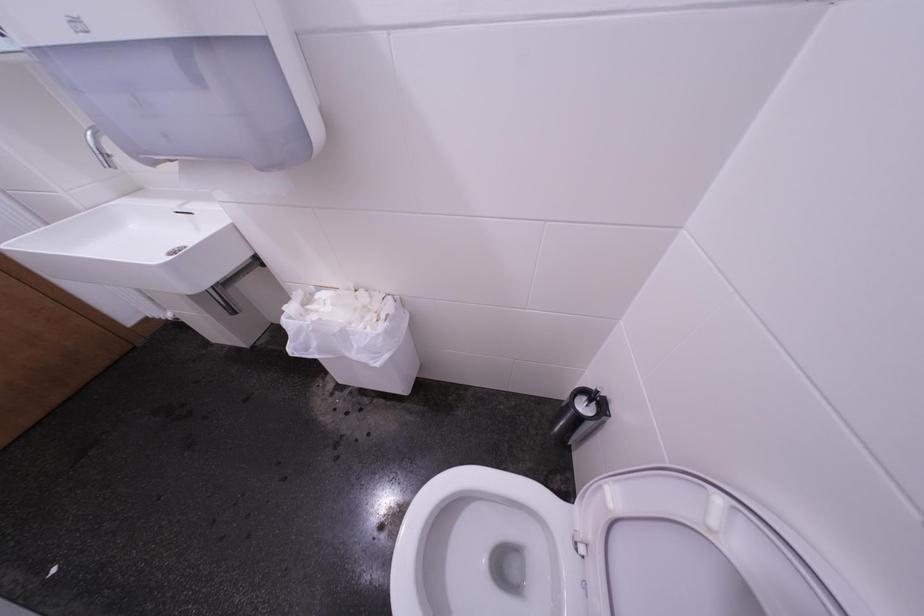
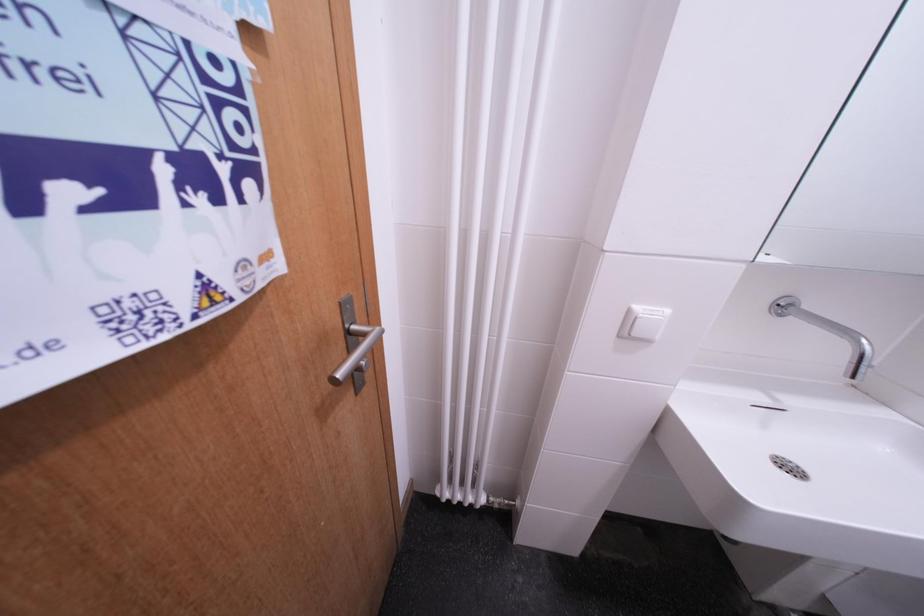
Question: Which direction would the cameraman need to move to produce the second image? Reply with the corresponding letter.

Choices:
 (A) Left
 (B) Right
 (C) Forward
 (D) Backward

Answer: (A)